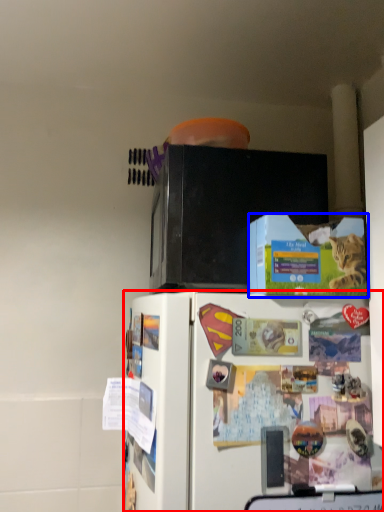
Question: Which point is further to the camera, refrigerator (highlighted by a red box) or box (highlighted by a blue box)?

Choices:
 (A) refrigerator
 (B) box

Answer: (B)